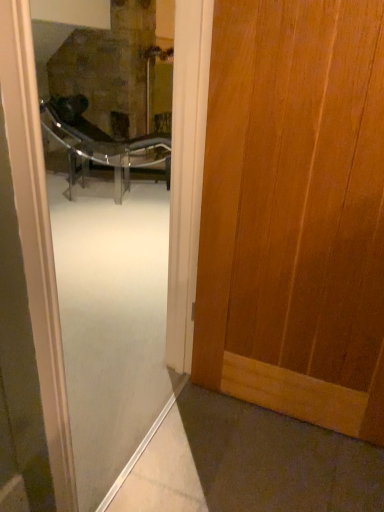
Question: Does transparent glass screen door at center have a smaller size compared to metallic glass chair at center?

Choices:
 (A) no
 (B) yes

Answer: (B)

Question: From a real-world perspective, does transparent glass screen door at center stand above metallic glass chair at center?

Choices:
 (A) no
 (B) yes

Answer: (B)

Question: From a real-world perspective, is transparent glass screen door at center under metallic glass chair at center?

Choices:
 (A) no
 (B) yes

Answer: (A)

Question: Does transparent glass screen door at center lie in front of metallic glass chair at center?

Choices:
 (A) no
 (B) yes

Answer: (B)

Question: Does transparent glass screen door at center have a larger size compared to metallic glass chair at center?

Choices:
 (A) no
 (B) yes

Answer: (A)

Question: Considering the relative positions of transparent glass screen door at center and metallic glass chair at center in the image provided, is transparent glass screen door at center to the left of metallic glass chair at center from the viewer's perspective?

Choices:
 (A) no
 (B) yes

Answer: (A)

Question: From the image's perspective, does metallic glass chair at center appear higher than transparent glass screen door at center?

Choices:
 (A) no
 (B) yes

Answer: (B)

Question: Is transparent glass screen door at center at the back of metallic glass chair at center?

Choices:
 (A) no
 (B) yes

Answer: (A)

Question: Is metallic glass chair at center outside of transparent glass screen door at center?

Choices:
 (A) yes
 (B) no

Answer: (A)

Question: From the image's perspective, would you say metallic glass chair at center is shown under transparent glass screen door at center?

Choices:
 (A) no
 (B) yes

Answer: (A)

Question: Can you confirm if metallic glass chair at center is thinner than transparent glass screen door at center?

Choices:
 (A) yes
 (B) no

Answer: (B)

Question: Considering the relative sizes of metallic glass chair at center and transparent glass screen door at center in the image provided, is metallic glass chair at center wider than transparent glass screen door at center?

Choices:
 (A) yes
 (B) no

Answer: (A)

Question: From the image's perspective, is wooden door at right over transparent glass screen door at center?

Choices:
 (A) yes
 (B) no

Answer: (A)